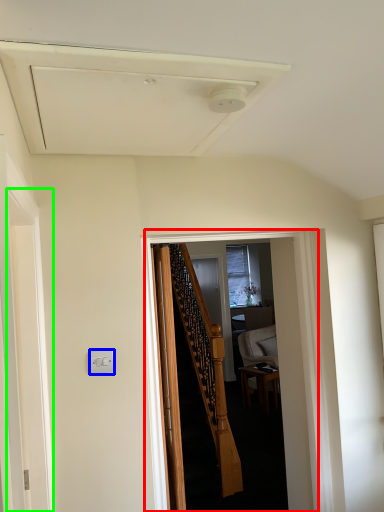
Question: Based on their relative distances, which object is nearer to corridor (highlighted by a red box)? Choose from electric outlet (highlighted by a blue box) and screen door (highlighted by a green box).

Choices:
 (A) electric outlet
 (B) screen door

Answer: (A)